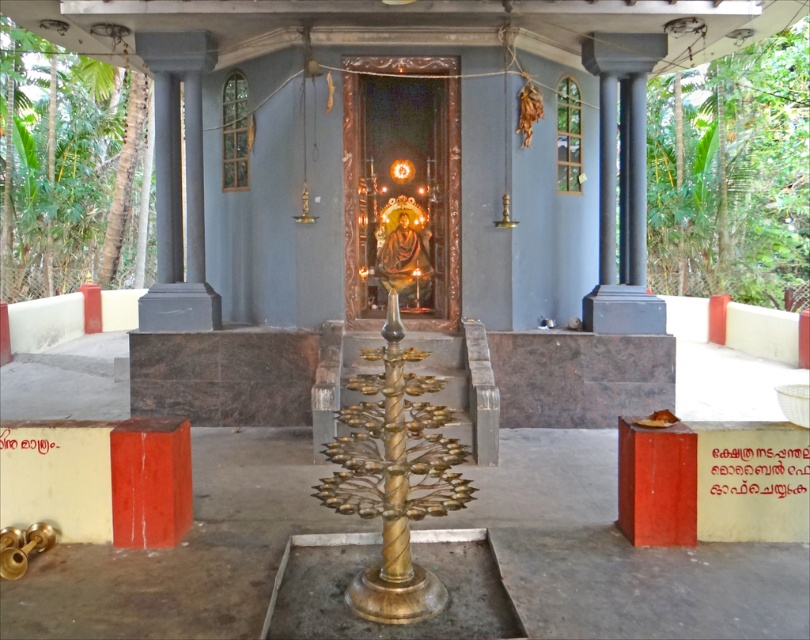
Which of these two, green leafy tree at right or green leafy tree at left, stands shorter?

With less height is green leafy tree at right.

Between green leafy tree at right and green leafy tree at left, which one is positioned lower?

Positioned lower is green leafy tree at right.

Between point (710, 173) and point (84, 58), which one is positioned in front?

Positioned in front is point (710, 173).

At what (x,y) coordinates should I click in order to perform the action: click on green leafy tree at right. Please return your answer as a coordinate pair (x, y). Looking at the image, I should click on (732, 176).